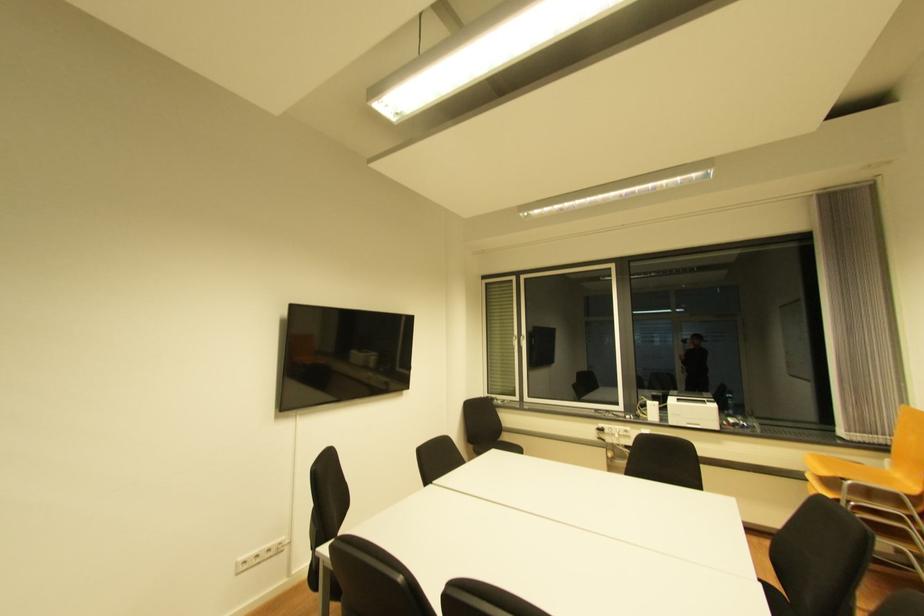
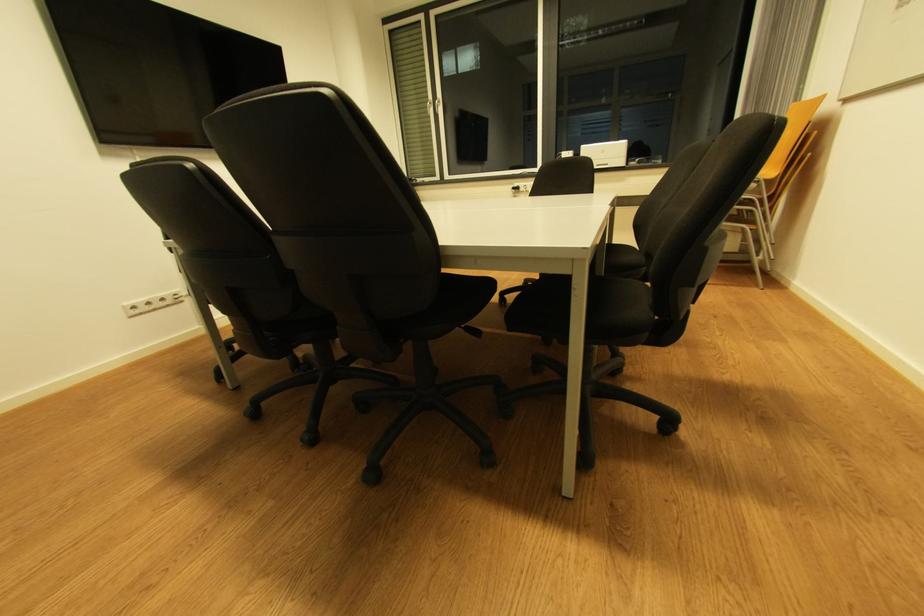
Question: In a continuous first-person perspective shot, in which direction is the camera moving?

Choices:
 (A) Left
 (B) Right
 (C) Forward
 (D) Backward

Answer: (B)